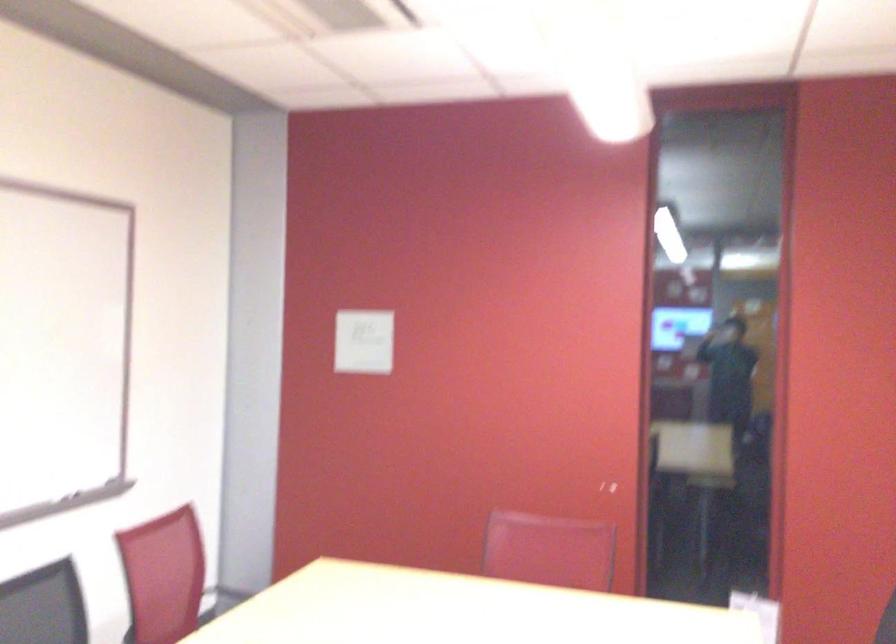
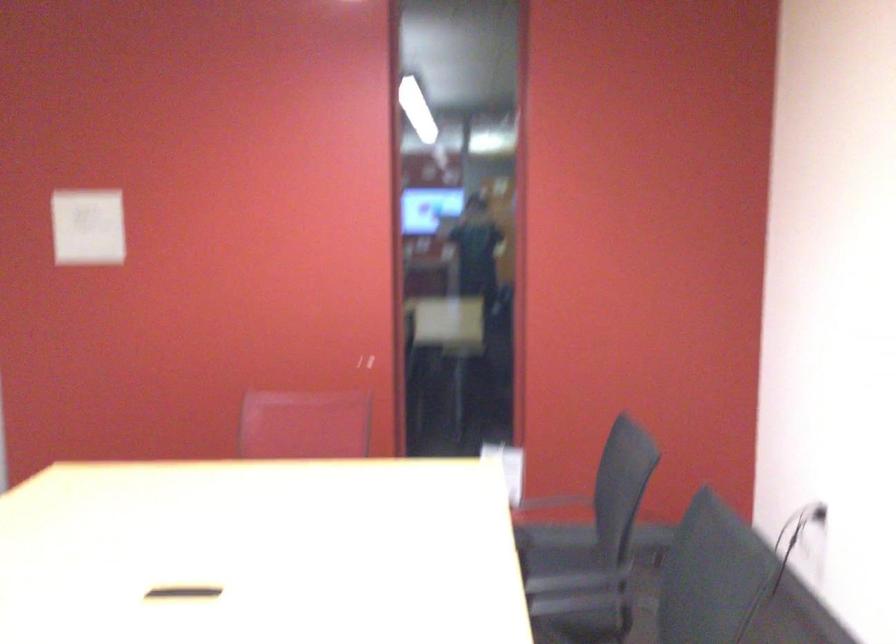
Question: Which direction would the cameraman need to move to produce the second image? Reply with the corresponding letter.

Choices:
 (A) Left
 (B) Right
 (C) Forward
 (D) Backward

Answer: (C)